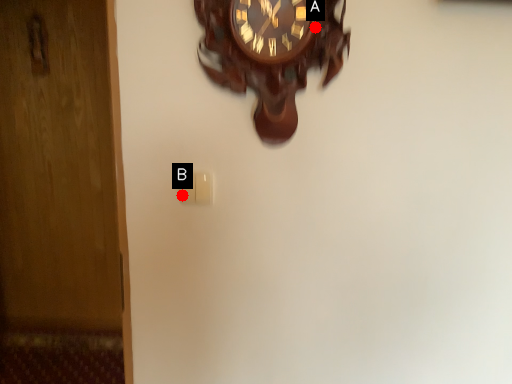
Question: Two points are circled on the image, labeled by A and B beside each circle. Which point is farther from the camera taking this photo?

Choices:
 (A) A is further
 (B) B is further

Answer: (B)